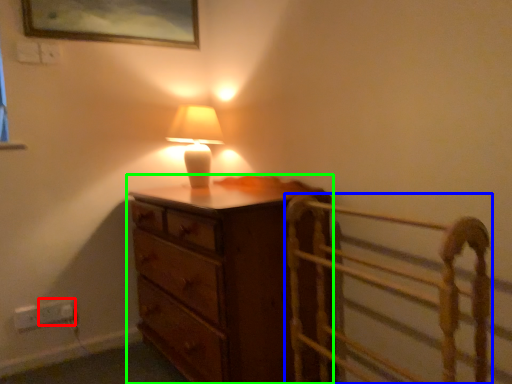
Question: Based on their relative distances, which object is nearer to electric outlet (highlighted by a red box)? Choose from bed frame (highlighted by a blue box) and chest of drawers (highlighted by a green box).

Choices:
 (A) bed frame
 (B) chest of drawers

Answer: (B)